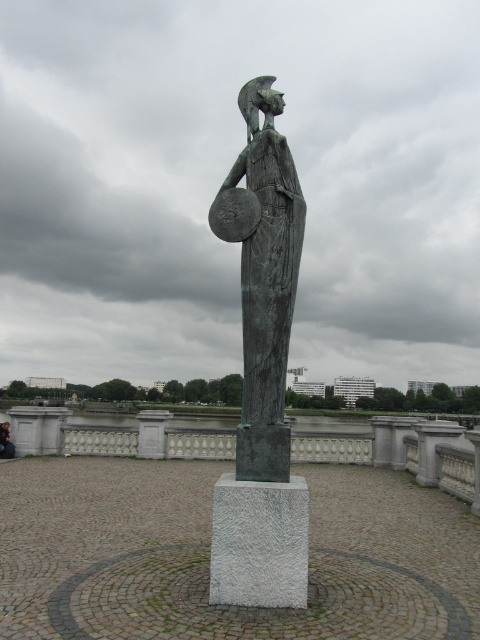
Question: Does green patina statue at center come behind dark brown leather jacket at center?

Choices:
 (A) no
 (B) yes

Answer: (A)

Question: Which object is closer to the camera taking this photo?

Choices:
 (A) dark brown leather jacket at center
 (B) green patina statue at center

Answer: (B)

Question: Does green patina statue at center have a lesser width compared to dark brown leather jacket at center?

Choices:
 (A) no
 (B) yes

Answer: (A)

Question: Where is green patina statue at center located in relation to dark brown leather jacket at center in the image?

Choices:
 (A) below
 (B) above

Answer: (B)